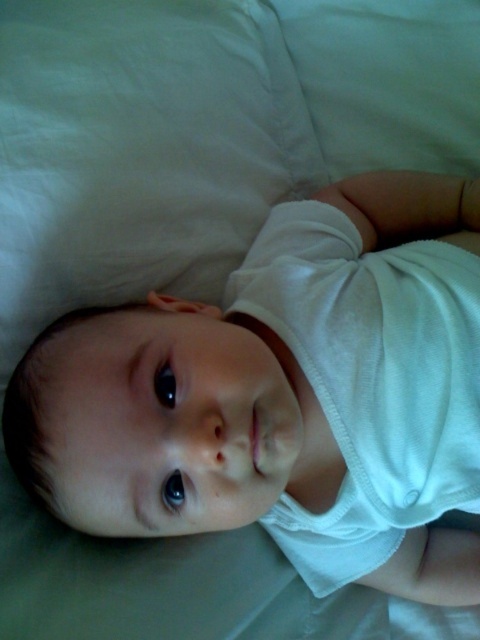
Does white fabric baby at center appear under white soft cloth diaper at center?

Indeed, white fabric baby at center is positioned under white soft cloth diaper at center.

Which is in front, point (460, 371) or point (292, 232)?

Point (460, 371)

In order to click on white fabric baby at center in this screenshot , I will do `click(285, 396)`.